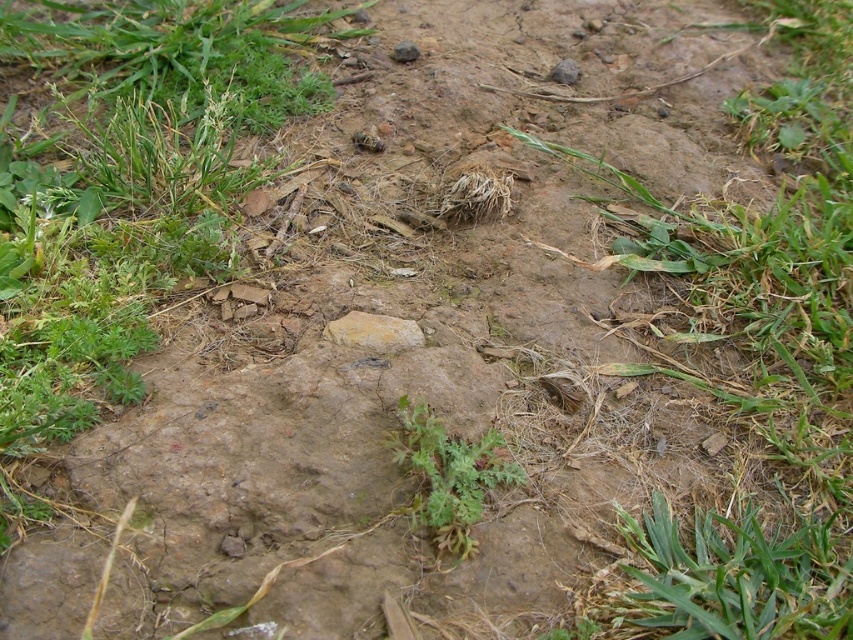
Question: Is green leafy grass at center smaller than yellowish rock at center?

Choices:
 (A) no
 (B) yes

Answer: (A)

Question: Which point is farther to the camera?

Choices:
 (A) green leafy grass at center
 (B) yellowish rock at center
 (C) green grass at center

Answer: (B)

Question: Can you confirm if green grass at center is positioned to the right of yellowish rock at center?

Choices:
 (A) yes
 (B) no

Answer: (A)

Question: Among these objects, which one is farthest from the camera?

Choices:
 (A) green grass at center
 (B) yellowish rock at center

Answer: (B)

Question: Which point appears closest to the camera in this image?

Choices:
 (A) (368, 314)
 (B) (38, 289)

Answer: (B)

Question: Is green grass at center bigger than yellowish rock at center?

Choices:
 (A) no
 (B) yes

Answer: (B)